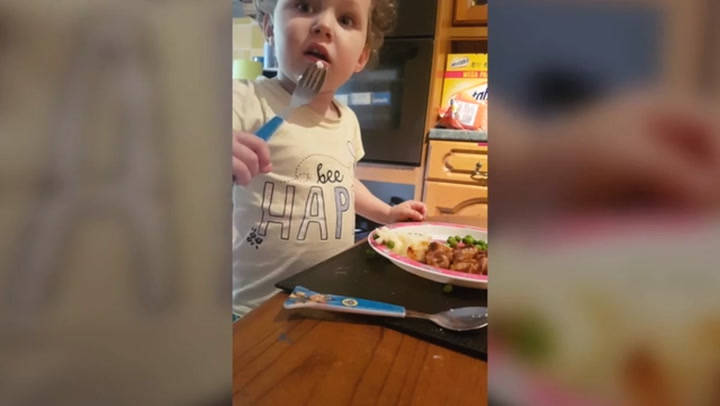
Where is `fork`? fork is located at coordinates (304, 90).